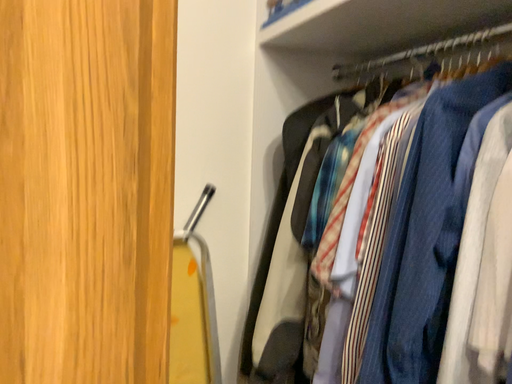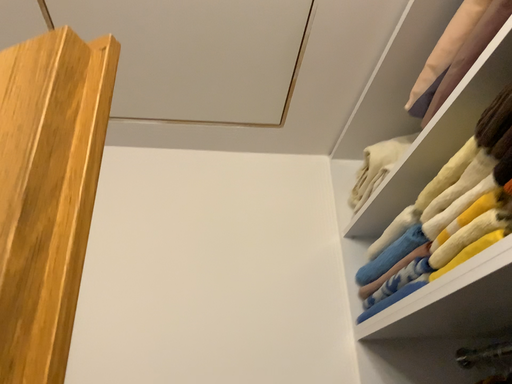
Question: How did the camera likely rotate when shooting the video?

Choices:
 (A) rotated left
 (B) rotated right

Answer: (A)